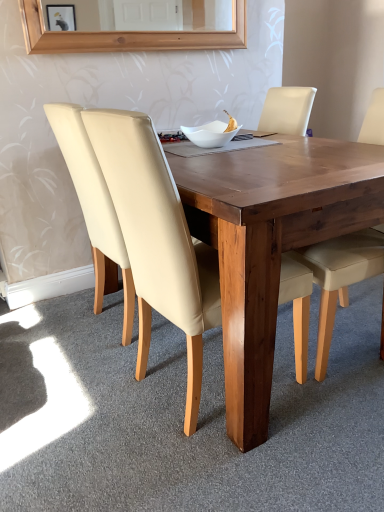
Question: From the image's perspective, is beige leather chair at left, which appears as the second chair when viewed from the left, located above or below beige leather chair at center, which appears as the first chair when viewed from the right?

Choices:
 (A) below
 (B) above

Answer: (A)

Question: Considering their positions, is beige leather chair at left, which appears as the second chair when viewed from the right, located in front of or behind beige leather chair at center, which appears as the first chair when viewed from the right?

Choices:
 (A) behind
 (B) front

Answer: (B)

Question: Which object is the farthest from the beige leather chair at center, which is the third chair from left to right?

Choices:
 (A) wooden table at center
 (B) white glossy bowl at center
 (C) beige leather chair at left, placed as the third chair when sorted from right to left
 (D) beige leather chair at left, which appears as the second chair when viewed from the left

Answer: (C)

Question: Which object is positioned closest to the beige leather chair at left, the first chair positioned from the left?

Choices:
 (A) beige leather chair at left, which appears as the second chair when viewed from the left
 (B) white glossy bowl at center
 (C) wooden table at center
 (D) beige leather chair at center, which is the third chair from left to right

Answer: (A)